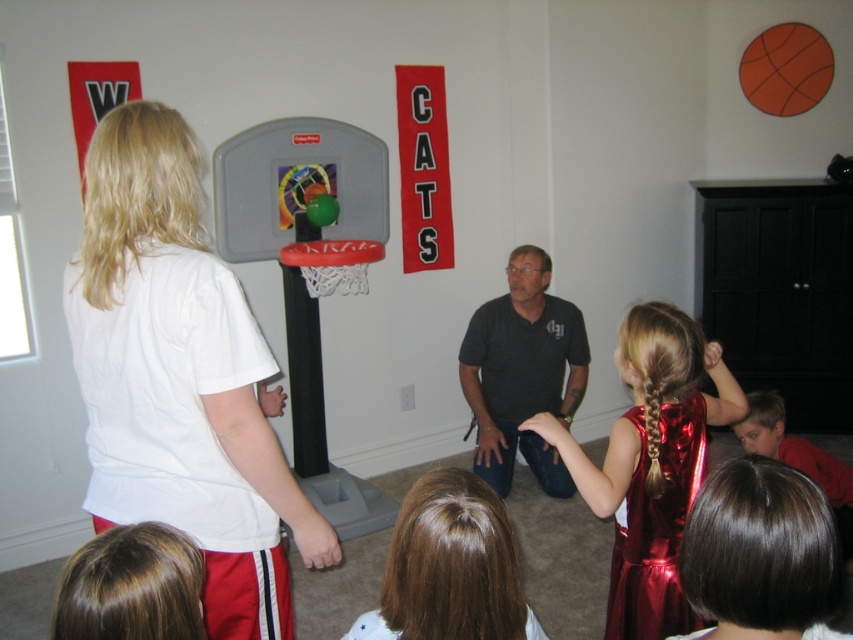
Is point (469, 541) behind point (503, 412)?

No, (469, 541) is in front of (503, 412).

Where is `brown shiny hair at lower center`? brown shiny hair at lower center is located at coordinates (450, 566).

This screenshot has height=640, width=853. What do you see at coordinates (761, 554) in the screenshot?
I see `shiny dark brown hair at lower right` at bounding box center [761, 554].

Can you confirm if shiny dark brown hair at lower right is taller than orange matte basketball at upper right?

No, shiny dark brown hair at lower right is not taller than orange matte basketball at upper right.

Describe the element at coordinates (761, 554) in the screenshot. I see `shiny dark brown hair at lower right` at that location.

Locate an element on the screen. The image size is (853, 640). shiny dark brown hair at lower right is located at coordinates (761, 554).

What do you see at coordinates (450, 566) in the screenshot? The height and width of the screenshot is (640, 853). I see `brown shiny hair at lower center` at bounding box center [450, 566].

Can you confirm if brown shiny hair at lower center is wider than orange matte basketball at upper right?

No, brown shiny hair at lower center is not wider than orange matte basketball at upper right.

Is point (509, 584) in front of point (784, 106)?

Yes, it is in front of point (784, 106).

Where is `brown shiny hair at lower center`? This screenshot has height=640, width=853. brown shiny hair at lower center is located at coordinates (450, 566).